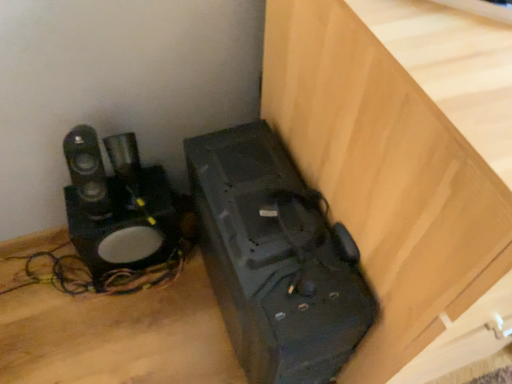
The height and width of the screenshot is (384, 512). Identify the location of free point above matte black speaker at lower right (from a real-world perspective). (286, 238).